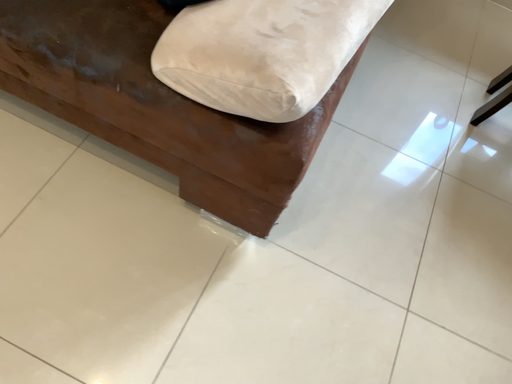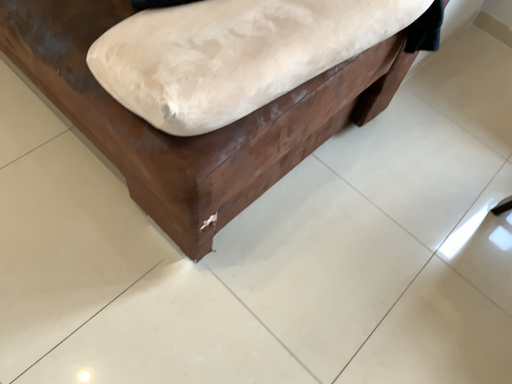
Question: How did the camera likely rotate when shooting the video?

Choices:
 (A) rotated downward
 (B) rotated upward

Answer: (B)